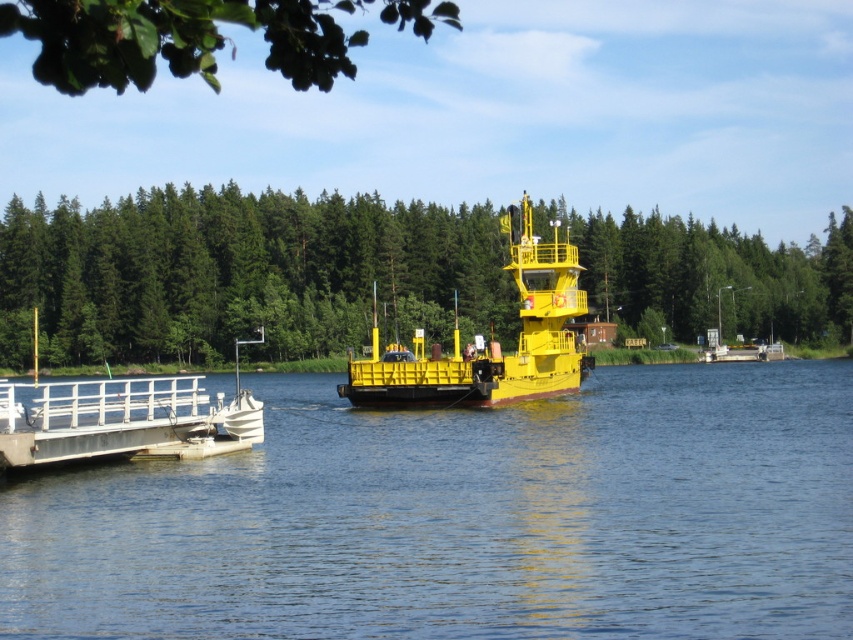
You are an observer standing on the white matte dock at lower left. You notice a green leafy branch at upper left above you. Which object has a greater width?

The green leafy branch at upper left has a greater width than the white matte dock at lower left.

You are a photographer trying to capture the yellow matte boat at center in the image. You want to ensure the boat is framed such that its width doesn not exceed the width of the blue water at center. Is this possible given the scene?

The blue water at center is wider than the yellow matte boat at center, so yes, the boat can be framed without exceeding the water width.

You are a sailor trying to navigate a small boat through the blue water at center. The yellow matte boat at center is in your path. Based on their sizes, which object takes up more space in the scene?

The yellow matte boat at center takes up more space in the scene because the blue water at center has a smaller size compared to it.